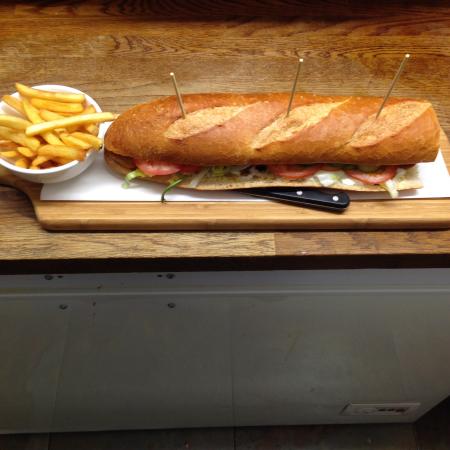
Image resolution: width=450 pixels, height=450 pixels. What are the coordinates of `1 wooden cutboard` in the screenshot? It's located at (79, 213).